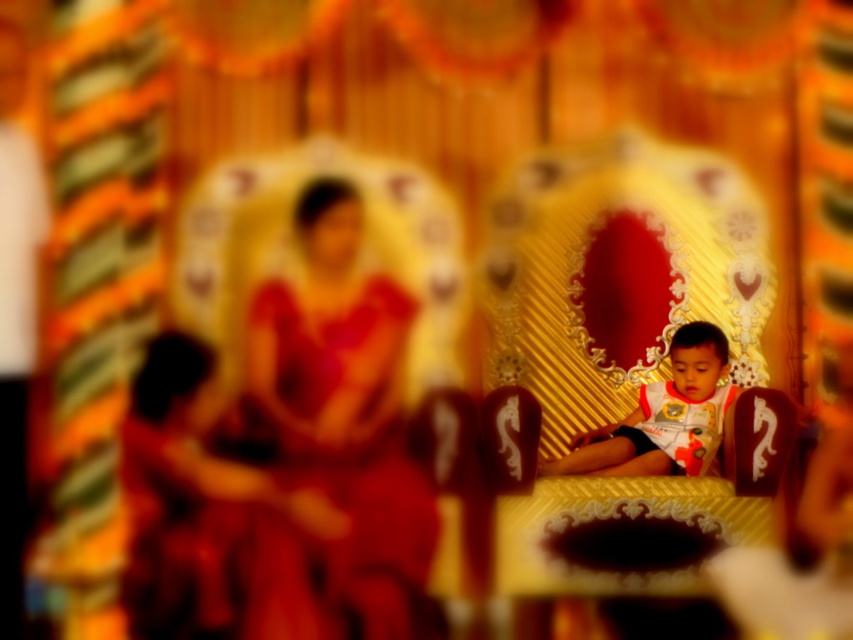
Which is behind, point (366, 417) or point (171, 500)?

The point (366, 417) is more distant.

Does point (351, 266) lie in front of point (209, 604)?

No, it is not.

What are the coordinates of `matte red robe at center` in the screenshot? It's located at 334,435.

The height and width of the screenshot is (640, 853). What are the coordinates of `matte red robe at center` in the screenshot? It's located at (334, 435).

From the picture: Does matte red robe at center have a lesser height compared to white printed shirt at center?

Incorrect, matte red robe at center's height does not fall short of white printed shirt at center's.

Which of these two, matte red robe at center or white printed shirt at center, stands taller?

Standing taller between the two is matte red robe at center.

Is point (326, 230) closer to viewer compared to point (715, 438)?

No, (326, 230) is behind (715, 438).

Where is `matte red robe at center`? The height and width of the screenshot is (640, 853). matte red robe at center is located at coordinates [334, 435].

This screenshot has height=640, width=853. What do you see at coordinates (190, 499) in the screenshot?
I see `matte red dress at left` at bounding box center [190, 499].

Is point (306, 493) farther from camera compared to point (724, 376)?

Yes.

Locate an element on the screen. matte red dress at left is located at coordinates (190, 499).